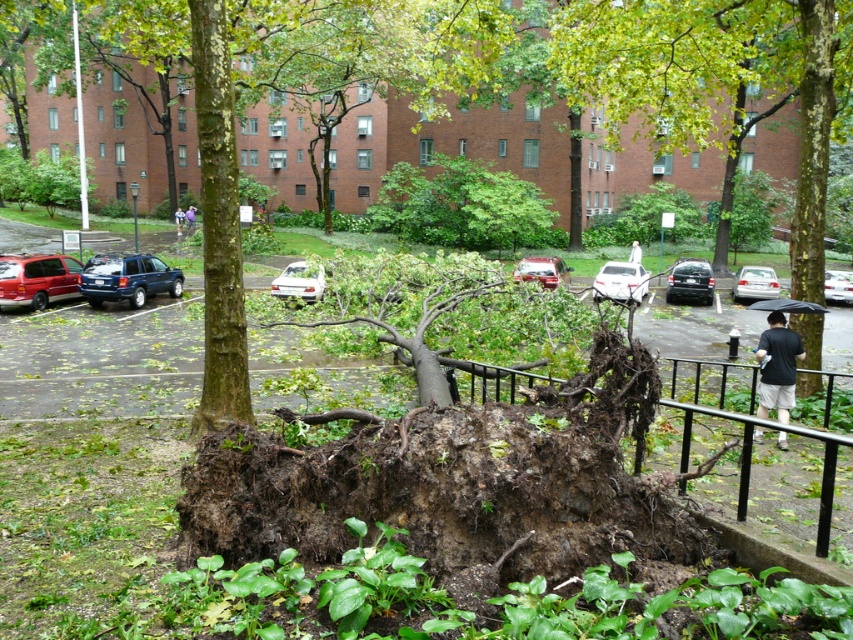
Between point (112, 266) and point (541, 259), which one is positioned in front?

Point (112, 266) is in front.

Is point (148, 260) positioned before point (537, 266)?

Yes, point (148, 260) is in front of point (537, 266).

Where is `blue metallic suv at center`? blue metallic suv at center is located at coordinates (126, 278).

Who is more forward, (96, 256) or (177, 221)?

Point (96, 256) is more forward.

Is blue metallic suv at center to the right of dark blue shirt at center from the viewer's perspective?

Correct, you'll find blue metallic suv at center to the right of dark blue shirt at center.

Identify the location of blue metallic suv at center. (126, 278).

Is matte red van at left taller than white fabric umbrella at center?

No, matte red van at left is not taller than white fabric umbrella at center.

Which is behind, point (55, 275) or point (634, 248)?

The point (634, 248) is behind.

Locate an element on the screen. The image size is (853, 640). matte red van at left is located at coordinates (38, 280).

The width and height of the screenshot is (853, 640). I want to click on matte red van at left, so pyautogui.click(x=38, y=280).